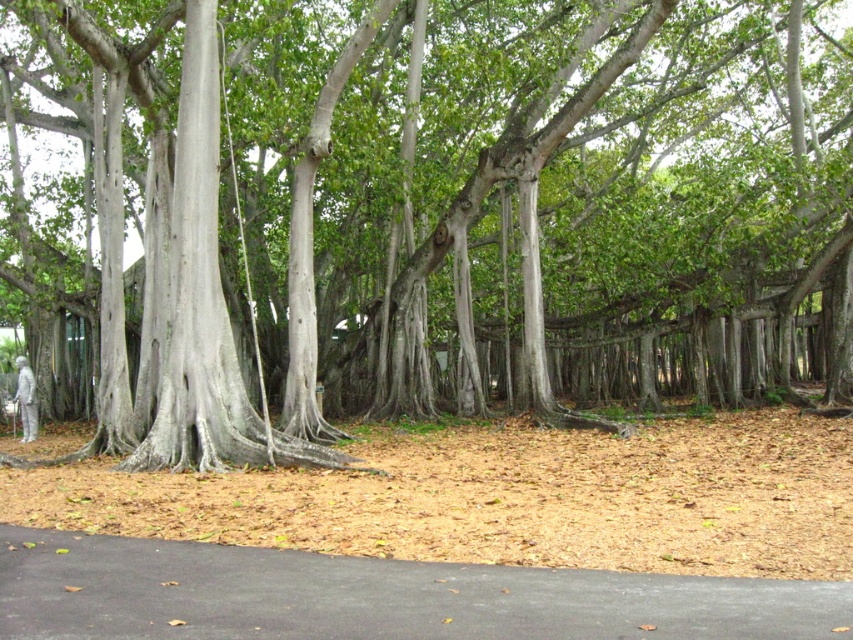
Question: Is green leafy tree at center below black asphalt path at lower center?

Choices:
 (A) no
 (B) yes

Answer: (A)

Question: Among these points, which one is farthest from the camera?

Choices:
 (A) (805, 628)
 (B) (15, 401)
 (C) (112, 49)

Answer: (B)

Question: Can you confirm if green leafy tree at center is wider than black asphalt path at lower center?

Choices:
 (A) no
 (B) yes

Answer: (B)

Question: Can you confirm if black asphalt path at lower center is positioned below silver metallic statue at lower left?

Choices:
 (A) no
 (B) yes

Answer: (B)

Question: Which point is closer to the camera?

Choices:
 (A) (264, 289)
 (B) (782, 637)
 (C) (28, 388)
 (D) (202, 392)

Answer: (B)

Question: Which object is positioned farthest from the black asphalt path at lower center?

Choices:
 (A) silver metallic statue at lower left
 (B) smooth gray bark at left

Answer: (A)